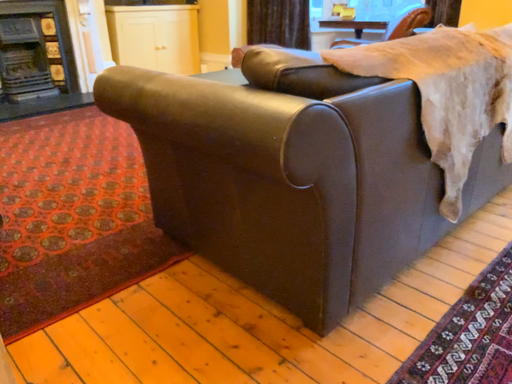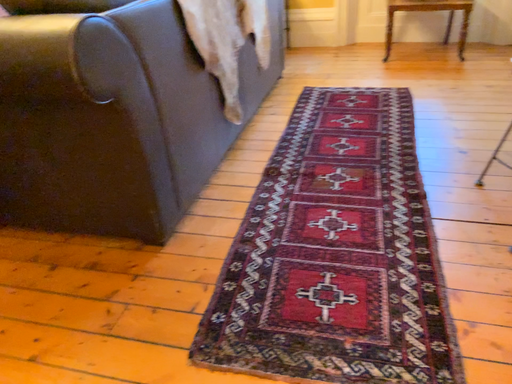
Question: Which way did the camera rotate in the video?

Choices:
 (A) rotated right
 (B) rotated left

Answer: (A)